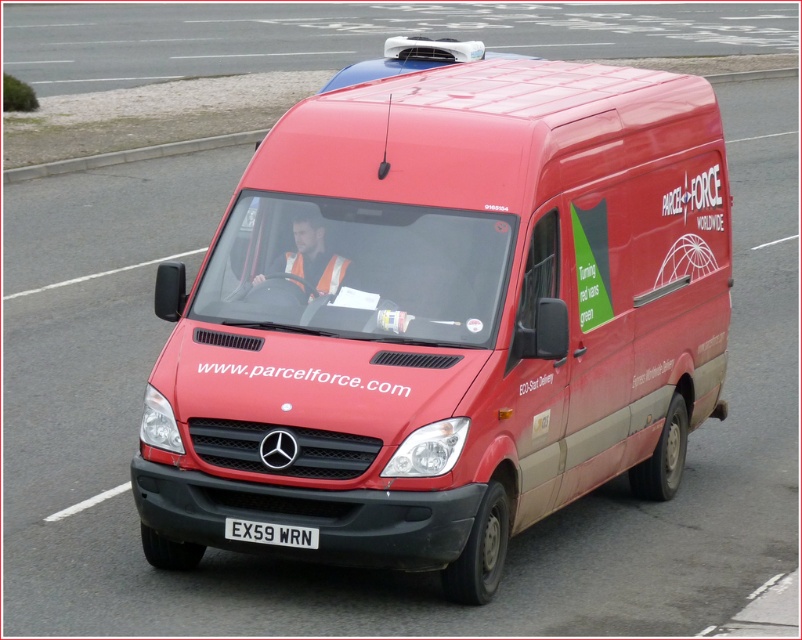
Question: Is matte red van at center below white plastic license plate at center?

Choices:
 (A) no
 (B) yes

Answer: (A)

Question: Which object is closer to the camera taking this photo?

Choices:
 (A) reflective orange vest at center
 (B) white plastic license plate at center

Answer: (B)

Question: Which point is farther to the camera?

Choices:
 (A) reflective orange vest at center
 (B) white plastic license plate at center

Answer: (A)

Question: Which point is farther from the camera taking this photo?

Choices:
 (A) (306, 214)
 (B) (235, 536)

Answer: (A)

Question: Is matte red van at center wider than reflective orange vest at center?

Choices:
 (A) yes
 (B) no

Answer: (A)

Question: Is matte red van at center wider than reflective orange vest at center?

Choices:
 (A) no
 (B) yes

Answer: (B)